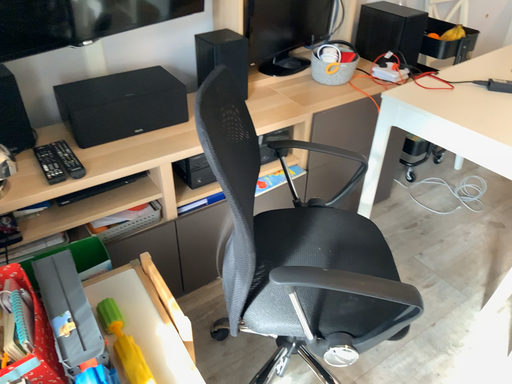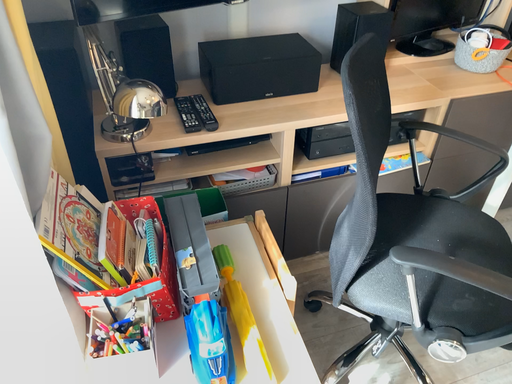
Question: Which way did the camera rotate in the video?

Choices:
 (A) rotated right
 (B) rotated left

Answer: (B)